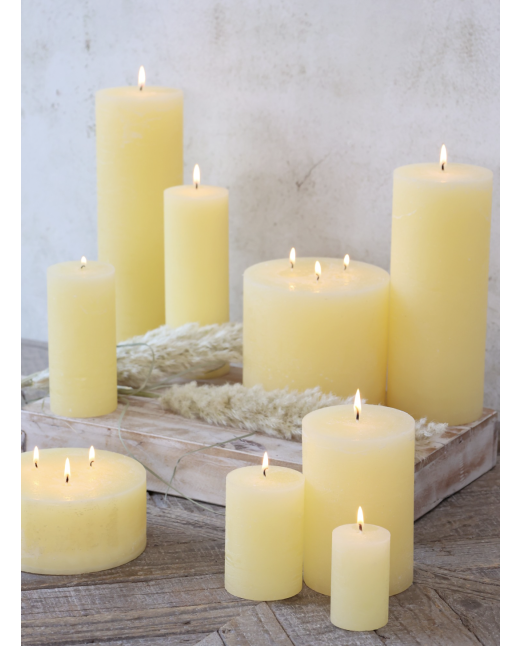
Find the location of `candles on left side of image`. candles on left side of image is located at coordinates (127, 162), (200, 231), (98, 309), (84, 497).